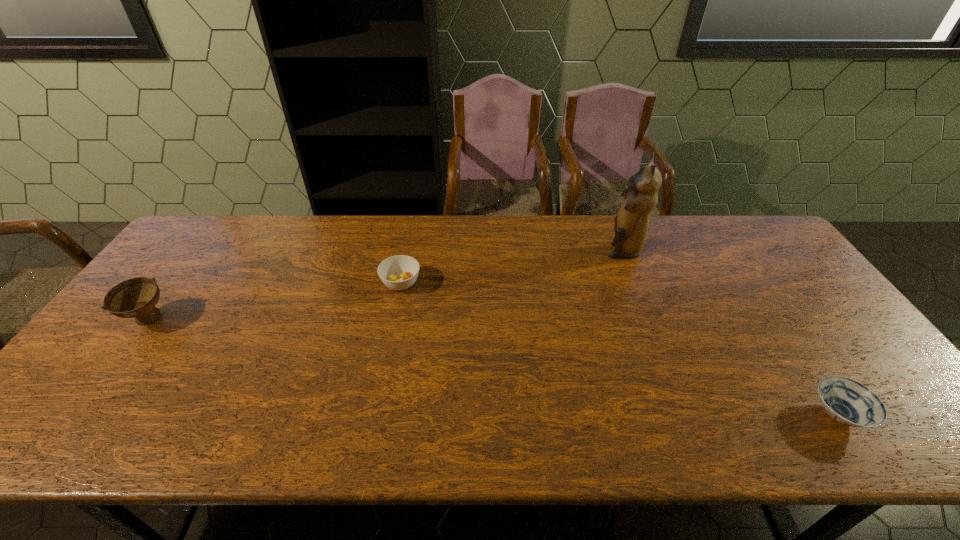
Where is `free space located 0.300m on the face of the tallest object`? The width and height of the screenshot is (960, 540). free space located 0.300m on the face of the tallest object is located at coordinates (514, 249).

Where is `free spot located 0.380m on the back of the leftmost object`? The image size is (960, 540). free spot located 0.380m on the back of the leftmost object is located at coordinates (219, 226).

Find the location of a particular element. This screenshot has width=960, height=540. vacant space located 0.220m on the left of the third nearest object is located at coordinates (307, 283).

The height and width of the screenshot is (540, 960). Find the location of `vacant space situated on the back of the nearest soup bowl`. vacant space situated on the back of the nearest soup bowl is located at coordinates (785, 335).

Locate an element on the screen. The width and height of the screenshot is (960, 540). object that is at the far edge is located at coordinates (631, 225).

At what (x,y) coordinates should I click in order to perform the action: click on object that is at the near edge. Please return your answer as a coordinate pair (x, y). Looking at the image, I should click on (849, 402).

Locate an element on the screen. The height and width of the screenshot is (540, 960). object that is at the left edge is located at coordinates (137, 297).

Where is `object at the right edge`? The height and width of the screenshot is (540, 960). object at the right edge is located at coordinates (849, 402).

The height and width of the screenshot is (540, 960). Identify the location of object that is at the near right corner. (849, 402).

At what (x,y) coordinates should I click in order to perform the action: click on vacant space at the far edge. Please return your answer as a coordinate pair (x, y). The image size is (960, 540). Looking at the image, I should click on (543, 230).